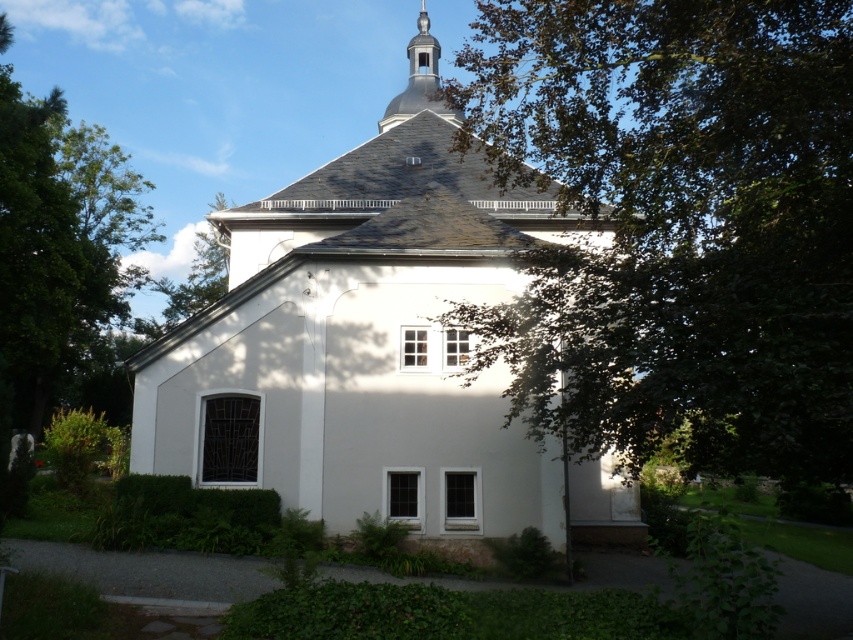
Does point (440, 228) lie in front of point (422, 108)?

That is True.

Does white smooth church at center have a larger size compared to smooth gray spire at upper center?

Yes.

Does point (519, 284) come behind point (421, 109)?

No, it is in front of (421, 109).

Locate an element on the screen. white smooth church at center is located at coordinates (370, 355).

Is green leafy tree at center bigger than green leafy tree at left?

No.

Which is more to the right, green leafy tree at center or green leafy tree at left?

green leafy tree at center

Does point (486, 308) come behind point (131, 282)?

No, (486, 308) is closer to viewer.

The width and height of the screenshot is (853, 640). I want to click on green leafy tree at center, so click(x=679, y=228).

Is white smooth church at center to the right of green leafy tree at left from the viewer's perspective?

Indeed, white smooth church at center is positioned on the right side of green leafy tree at left.

Which is above, white smooth church at center or green leafy tree at left?

Positioned higher is green leafy tree at left.

Looking at this image, who is more distant from viewer, (223, 474) or (71, 257)?

Point (71, 257)

Identify the location of white smooth church at center. This screenshot has width=853, height=640. (370, 355).